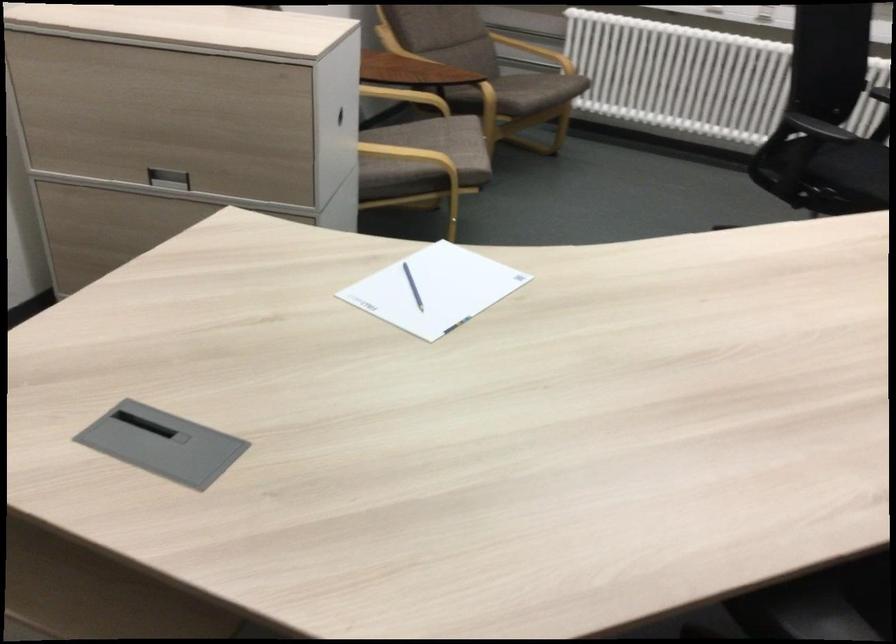
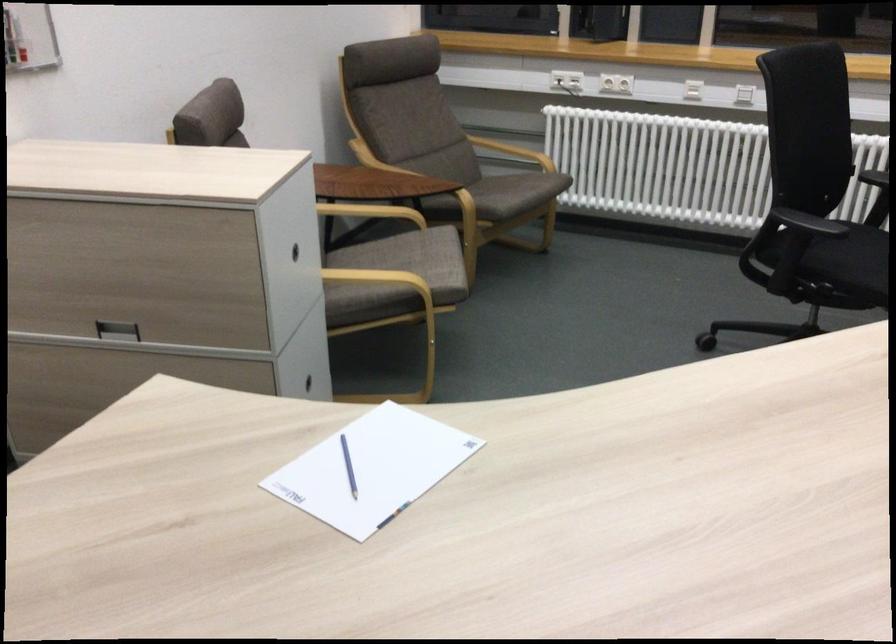
The point at (440, 144) is marked in the first image. Where is the corresponding point in the second image?

(412, 259)